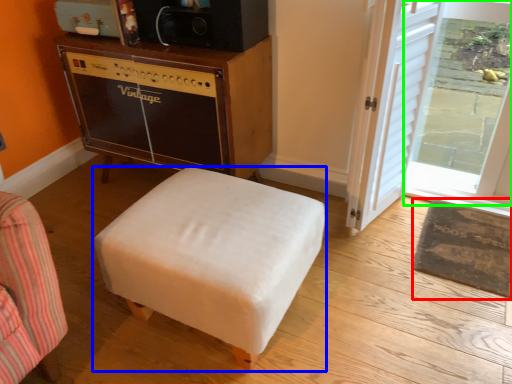
Question: Considering the real-world distances, which object is farthest from mat (highlighted by a red box)? furniture (highlighted by a blue box) or glass door (highlighted by a green box)?

Choices:
 (A) furniture
 (B) glass door

Answer: (A)